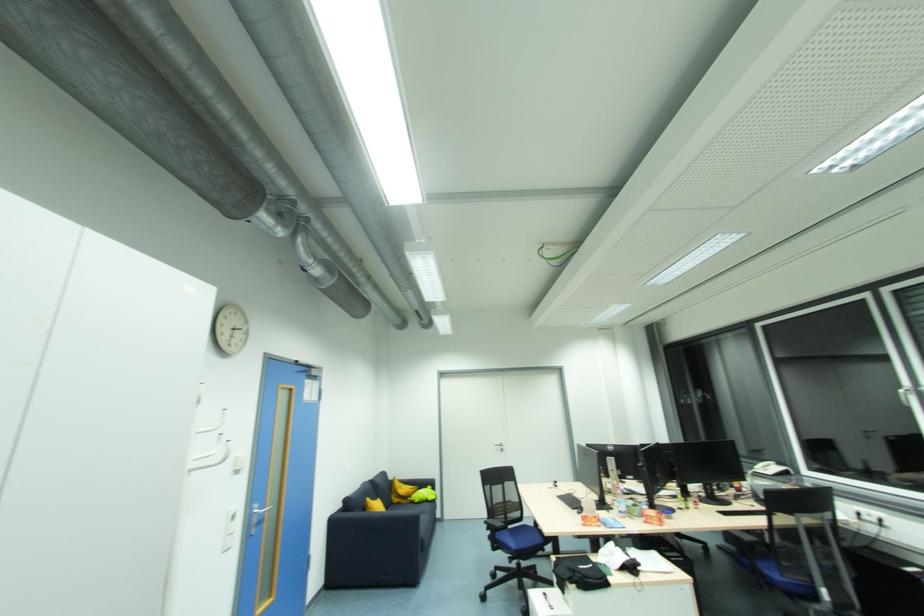
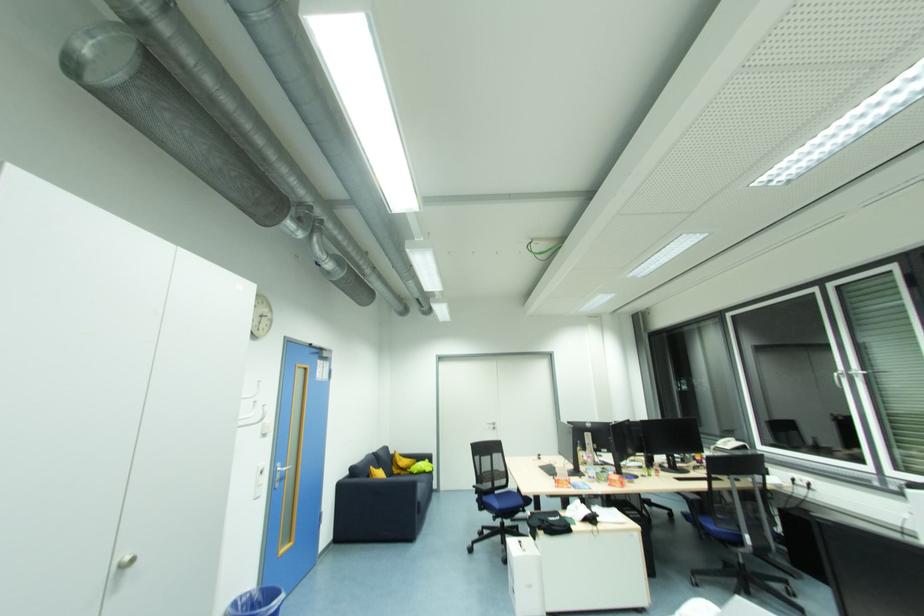
In the second image, find the point that corresponds to point 490,531 in the first image.

(480, 493)